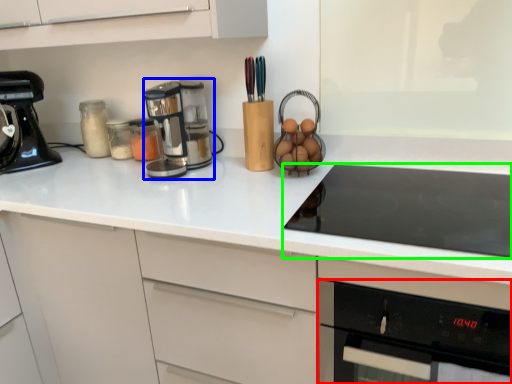
Question: Which is nearer to the oven (highlighted by a red box)? kitchen appliance (highlighted by a blue box) or gas stove (highlighted by a green box).

Choices:
 (A) kitchen appliance
 (B) gas stove

Answer: (B)